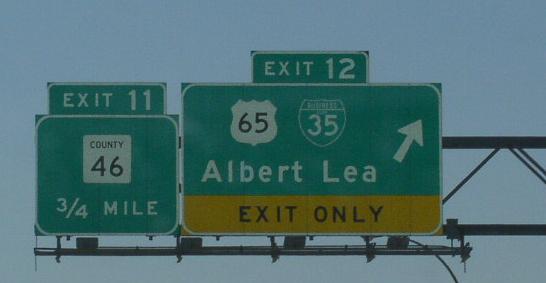
At what (x,y) coordinates should I click in order to perform the action: click on exit signs. Please return your answer as a coordinate pair (x, y). Image resolution: width=546 pixels, height=283 pixels. Looking at the image, I should click on (99, 99), (311, 68).